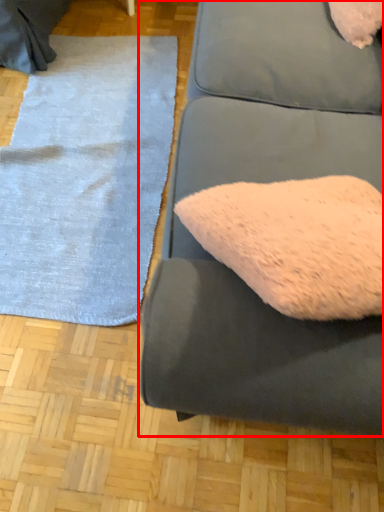
Question: Observing the image, what is the correct spatial positioning of studio couch (annotated by the red box) in reference to mat?

Choices:
 (A) right
 (B) left

Answer: (A)